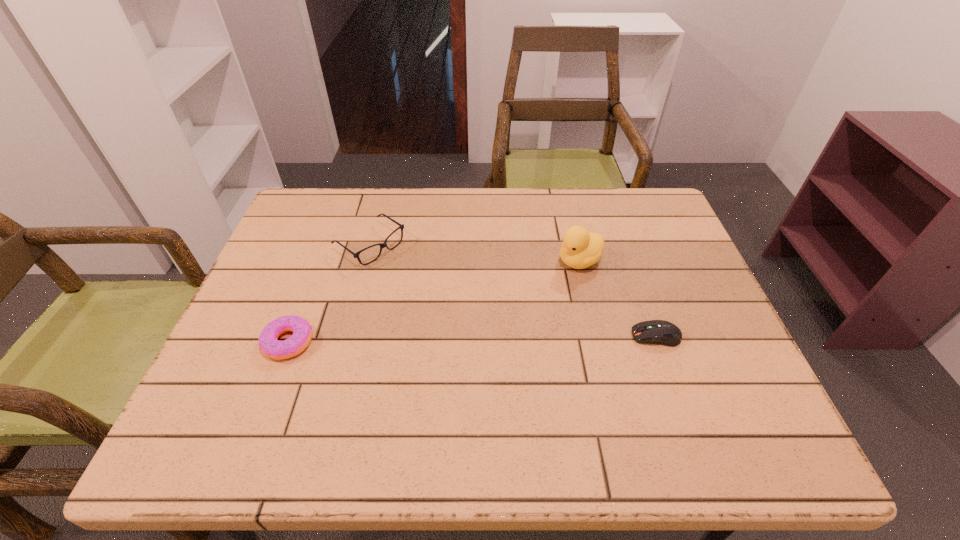
Where is `blank region between the third shortest object and the tallest object`? The image size is (960, 540). blank region between the third shortest object and the tallest object is located at coordinates (475, 253).

Identify the location of unoccupied area between the doughnut and the spectacles. (329, 293).

Locate an element on the screen. free area in between the second object from right to left and the doughnut is located at coordinates (434, 301).

The image size is (960, 540). I want to click on free spot between the doughnut and the spectacles, so click(x=329, y=293).

Locate an element on the screen. free space that is in between the second object from right to left and the rightmost object is located at coordinates (618, 299).

You are a GUI agent. You are given a task and a screenshot of the screen. Output one action in this format:
    pyautogui.click(x=<x>, y=<y>)
    Task: Click on the vacant space in between the third object from left to right and the computer equipment
    
    Given the screenshot: What is the action you would take?
    pyautogui.click(x=618, y=299)

Find the location of a particular element. vacant region between the spectacles and the doughnut is located at coordinates (329, 293).

Where is `the third closest object to the doughnut`? This screenshot has height=540, width=960. the third closest object to the doughnut is located at coordinates (661, 332).

Identify which object is the third nearest to the second tallest object. Please provide its 2D coordinates. Your answer should be formatted as a tuple, i.e. [(x, y)], where the tuple contains the x and y coordinates of a point satisfying the conditions above.

[(661, 332)]

Identify the location of vacant position in the image that satisfies the following two spatial constraints: 1. on the back side of the doughnut; 2. on the right side of the third shortest object. (325, 245).